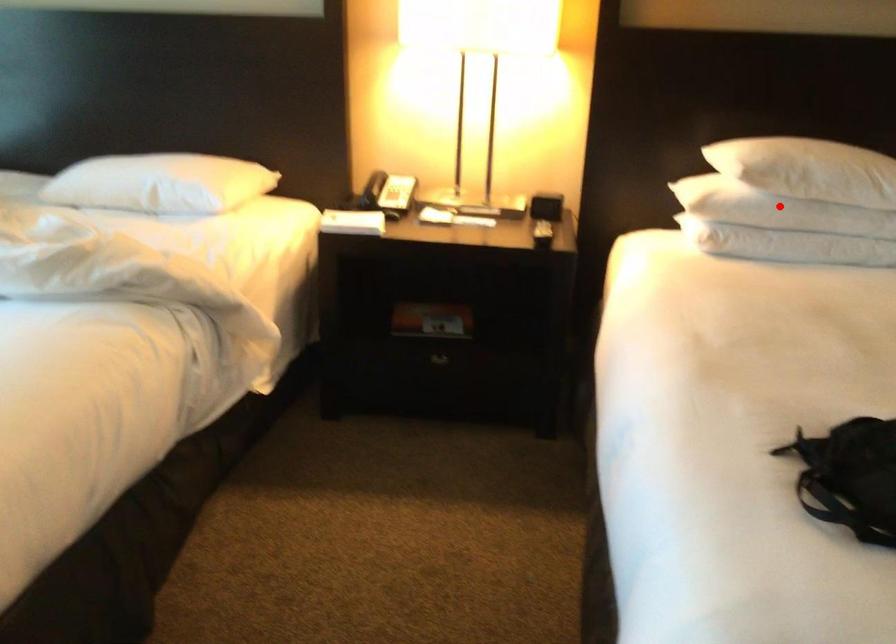
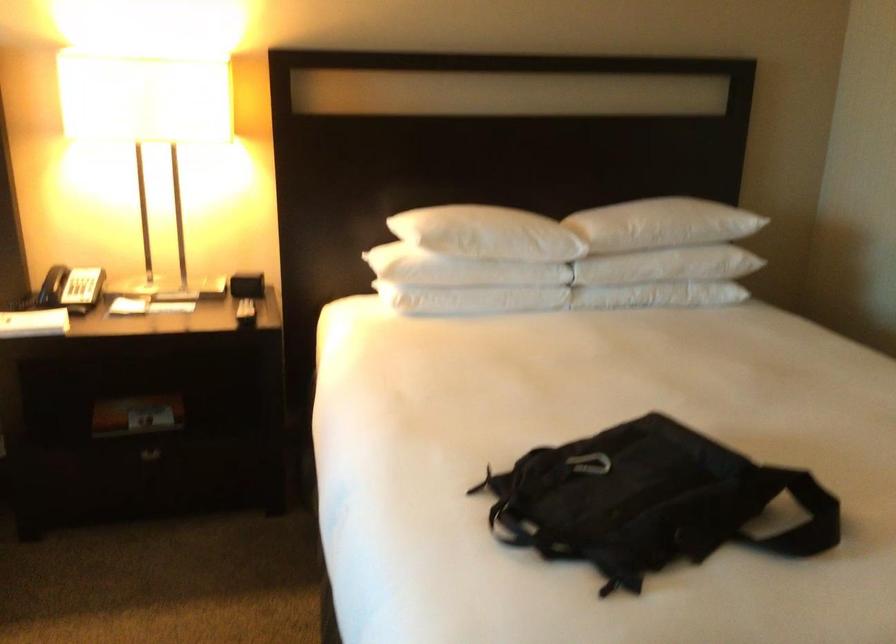
Question: I am providing you with two images of the same scene from different viewpoints. Given a red point in image1, look at the same physical point in image2. Is it:

Choices:
 (A) Closer to the viewpoint
 (B) Farther from the viewpoint

Answer: (B)